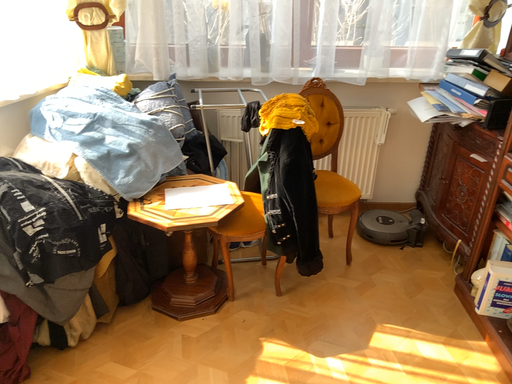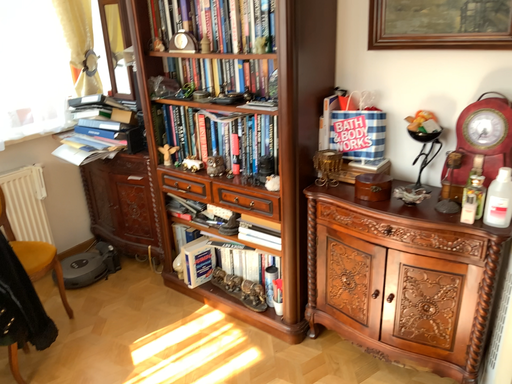
Question: How did the camera likely rotate when shooting the video?

Choices:
 (A) rotated right
 (B) rotated left

Answer: (A)